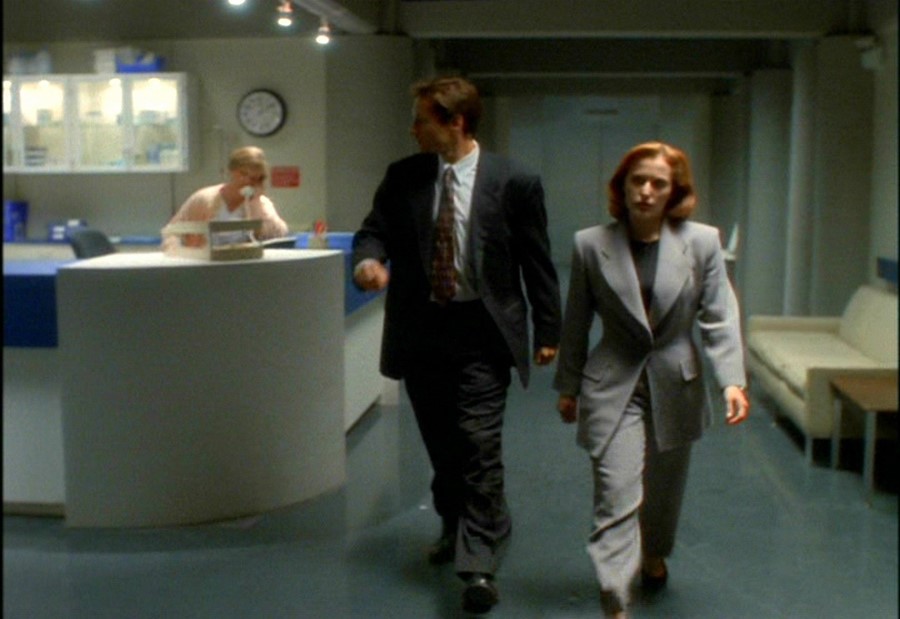
Image resolution: width=900 pixels, height=619 pixels. In order to click on doors in this screenshot , I will do `click(616, 144)`, `click(573, 153)`.